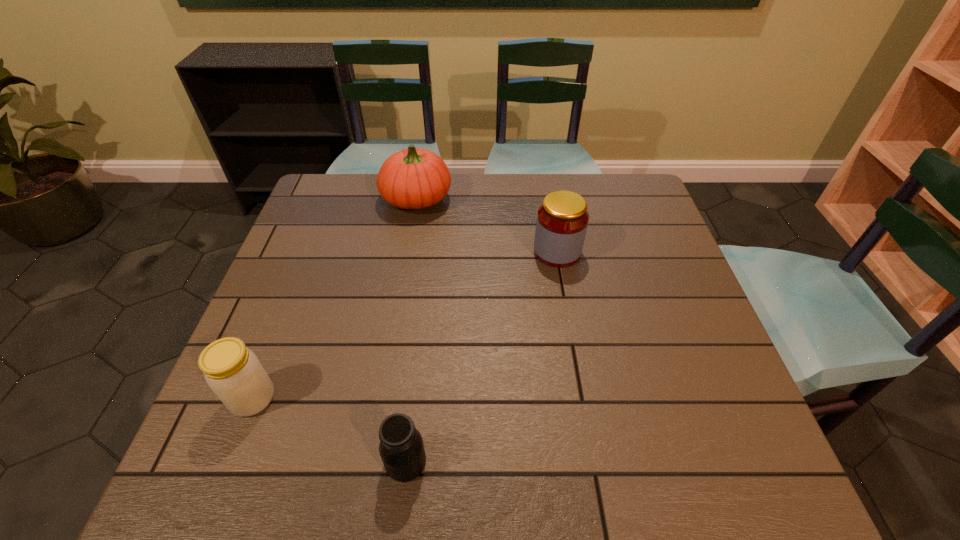
Find the location of a particular element. The width and height of the screenshot is (960, 540). free space located 0.180m on the left of the shortest jar is located at coordinates (288, 462).

Find the location of a particular element. object at the far edge is located at coordinates (413, 178).

Identify the location of object at the near edge. (401, 448).

The width and height of the screenshot is (960, 540). Find the location of `object located in the left edge section of the desktop`. object located in the left edge section of the desktop is located at coordinates (234, 373).

At what (x,y) coordinates should I click in order to perform the action: click on free location at the far edge of the desktop. Please return your answer as a coordinate pair (x, y). The height and width of the screenshot is (540, 960). Looking at the image, I should click on [x=470, y=195].

In the image, there is a desktop. Identify the location of vacant space at the near edge. The width and height of the screenshot is (960, 540). (378, 480).

Find the location of `vacant space at the left edge of the desktop`. vacant space at the left edge of the desktop is located at coordinates click(x=230, y=415).

At what (x,y) coordinates should I click in order to perform the action: click on vacant space at the right edge. Please return your answer as a coordinate pair (x, y). The image size is (960, 540). Looking at the image, I should click on (625, 237).

This screenshot has height=540, width=960. In order to click on vacant area at the far left corner in this screenshot , I will do `click(348, 211)`.

I want to click on vacant area that lies between the rightmost jar and the farthest object, so click(487, 225).